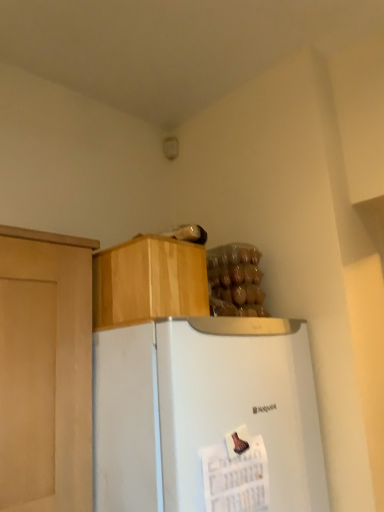
Question: Does translucent plastic bag of food at upper right have a lesser width compared to wooden cabinet at upper center?

Choices:
 (A) yes
 (B) no

Answer: (A)

Question: Is translucent plastic bag of food at upper right smaller than wooden cabinet at upper center?

Choices:
 (A) no
 (B) yes

Answer: (B)

Question: Considering the relative positions of translucent plastic bag of food at upper right and wooden cabinet at upper center in the image provided, is translucent plastic bag of food at upper right behind wooden cabinet at upper center?

Choices:
 (A) no
 (B) yes

Answer: (B)

Question: Is translucent plastic bag of food at upper right oriented towards wooden cabinet at upper center?

Choices:
 (A) yes
 (B) no

Answer: (B)

Question: From the image's perspective, is translucent plastic bag of food at upper right under wooden cabinet at upper center?

Choices:
 (A) no
 (B) yes

Answer: (B)

Question: Looking at the image, does white matte refrigerator at center seem bigger or smaller compared to wooden cabinet at upper center?

Choices:
 (A) big
 (B) small

Answer: (A)

Question: From the image's perspective, is white matte refrigerator at center located above or below wooden cabinet at upper center?

Choices:
 (A) above
 (B) below

Answer: (B)

Question: Considering their positions, is white matte refrigerator at center located in front of or behind wooden cabinet at upper center?

Choices:
 (A) behind
 (B) front

Answer: (B)

Question: In terms of width, does white matte refrigerator at center look wider or thinner when compared to wooden cabinet at upper center?

Choices:
 (A) wide
 (B) thin

Answer: (A)

Question: Is translucent plastic bag of food at upper right spatially inside white matte refrigerator at center, or outside of it?

Choices:
 (A) outside
 (B) inside

Answer: (A)

Question: Looking at their shapes, would you say translucent plastic bag of food at upper right is wider or thinner than white matte refrigerator at center?

Choices:
 (A) wide
 (B) thin

Answer: (B)

Question: From their relative heights in the image, would you say translucent plastic bag of food at upper right is taller or shorter than white matte refrigerator at center?

Choices:
 (A) tall
 (B) short

Answer: (B)

Question: Is translucent plastic bag of food at upper right to the left or to the right of white matte refrigerator at center in the image?

Choices:
 (A) right
 (B) left

Answer: (A)

Question: Looking at the image, does translucent plastic bag of food at upper right seem bigger or smaller compared to wooden cabinet at upper center?

Choices:
 (A) small
 (B) big

Answer: (A)

Question: Considering the positions of point (213, 273) and point (139, 238), is point (213, 273) closer or farther from the camera than point (139, 238)?

Choices:
 (A) farther
 (B) closer

Answer: (A)